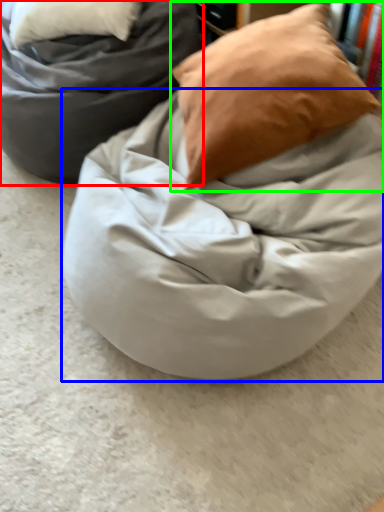
Question: Estimate the real-world distances between objects in this image. Which object is closer to furniture (highlighted by a red box), blanket (highlighted by a blue box) or pillow (highlighted by a green box)?

Choices:
 (A) blanket
 (B) pillow

Answer: (B)